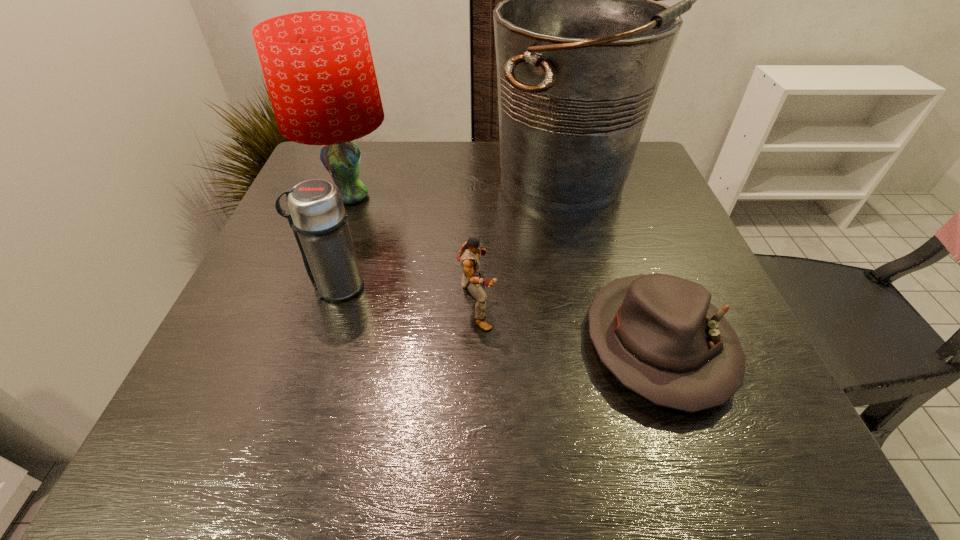
Find the location of `bucket`. bucket is located at coordinates (581, 42).

You are a GUI agent. You are given a task and a screenshot of the screen. Output one action in this format:
    pyautogui.click(x=<x>, y=<y>)
    Task: Click on the lampshade
    The image size is (960, 540).
    Given the screenshot: What is the action you would take?
    pyautogui.click(x=318, y=67)

Where is `thermos bottle`? thermos bottle is located at coordinates (316, 214).

Where is `the second shortest object`? the second shortest object is located at coordinates (470, 254).

Locate an element on the screen. This screenshot has height=540, width=960. hat is located at coordinates (659, 335).

Where is `free region located 0.160m on the left of the bucket`? free region located 0.160m on the left of the bucket is located at coordinates click(x=427, y=181).

At what (x,y) coordinates should I click in order to perform the action: click on vacant space located 0.210m on the front-facing side of the lampshade. Please return your answer as a coordinate pair (x, y). This screenshot has width=960, height=540. Looking at the image, I should click on (316, 293).

Where is `vacant space located with a handle on the side of the third shortest object`? Image resolution: width=960 pixels, height=540 pixels. vacant space located with a handle on the side of the third shortest object is located at coordinates [x=256, y=287].

Locate an element on the screen. vacant space located 0.050m with a handle on the side of the third shortest object is located at coordinates (281, 287).

I want to click on vacant area situated with a handle on the side of the third shortest object, so pyautogui.click(x=251, y=287).